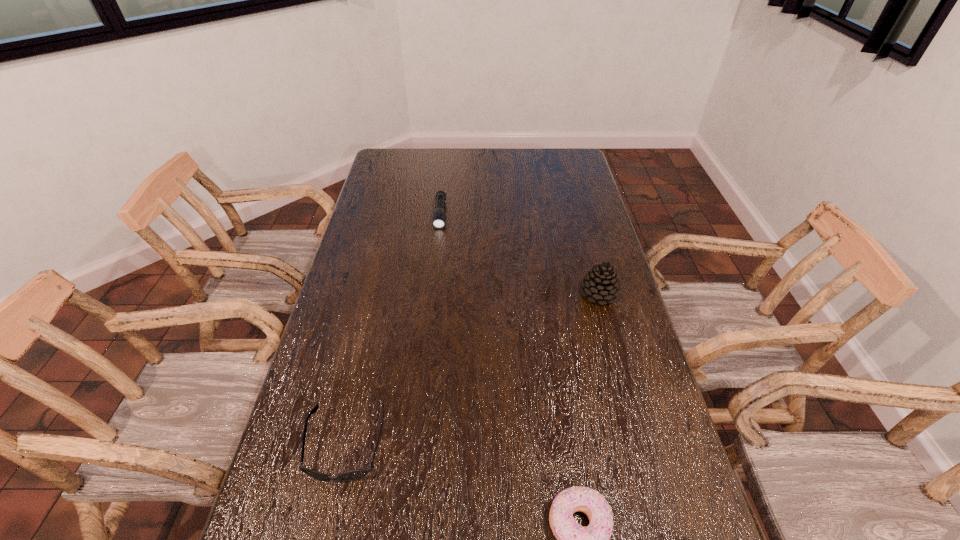
In order to click on vacant space on the desktop that is between the second nearest object and the doughnut and is positioned at the lens end of the second object from left to right in this screenshot , I will do `click(421, 472)`.

Identify the location of free space on the desktop that is between the sunglasses and the doughnut and is positioned at the narrow end of the tallest object. (x=439, y=478).